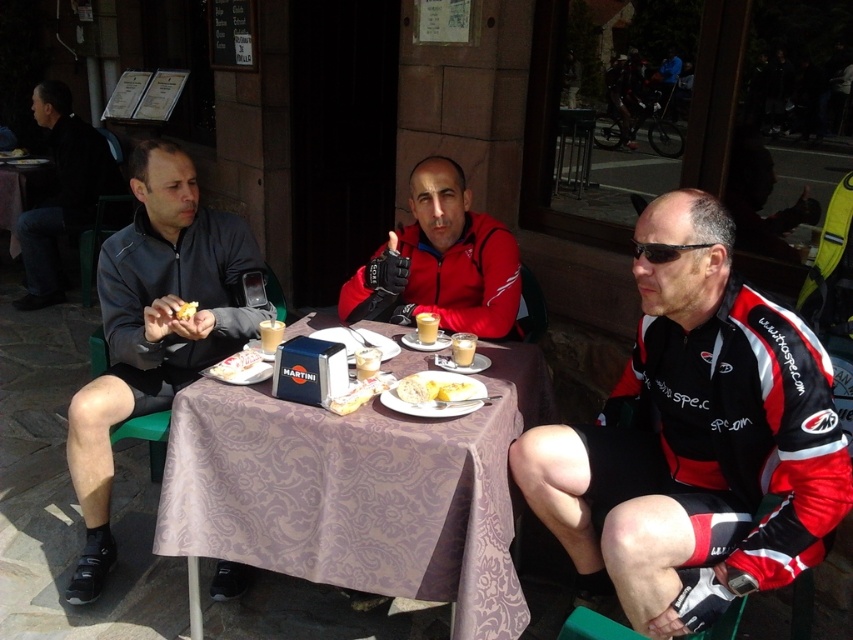
Question: Is white bread at table center closer to camera compared to white fluffy bread at center?

Choices:
 (A) no
 (B) yes

Answer: (B)

Question: Which of the following is the farthest from the observer?

Choices:
 (A) (228, 449)
 (B) (248, 268)
 (C) (422, 388)

Answer: (B)

Question: Where is matte red jacket at center located in relation to white fluffy bread at center in the image?

Choices:
 (A) left
 (B) right

Answer: (B)

Question: Which object is positioned farthest from the white creamy cake at center?

Choices:
 (A) white bread at table center
 (B) dark gray jacket at upper left
 (C) white fluffy bread at center
 (D) red and black cycling jersey at center

Answer: (B)

Question: Which of these objects is positioned farthest from the yellow crumbly bread at center?

Choices:
 (A) white bread at table center
 (B) red and black cycling jersey at center
 (C) dark gray jacket at left
 (D) dark gray jacket at upper left

Answer: (D)

Question: Can you confirm if red and black cycling jersey at center is positioned below yellow matte bread at center?

Choices:
 (A) yes
 (B) no

Answer: (A)